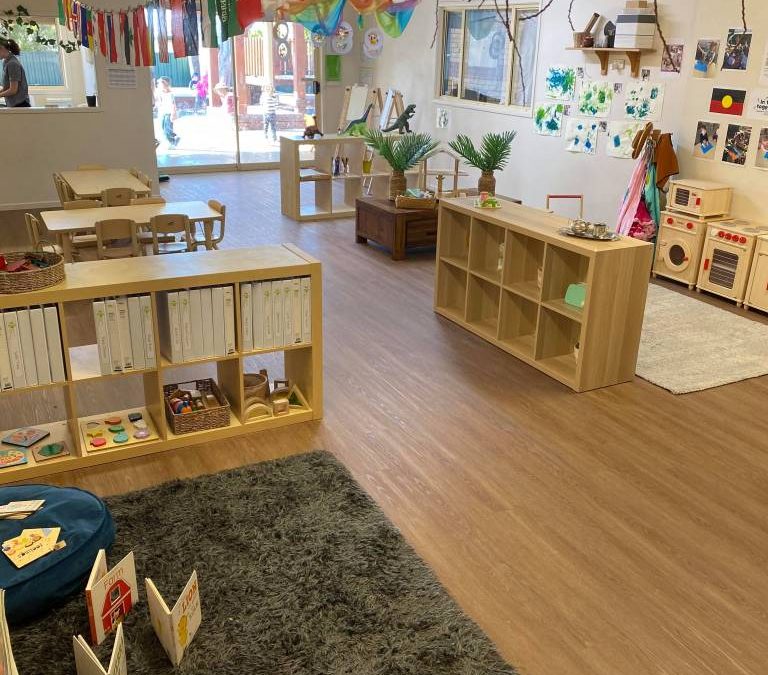
This screenshot has width=768, height=675. I want to click on white hardcover books, so click(x=187, y=320).